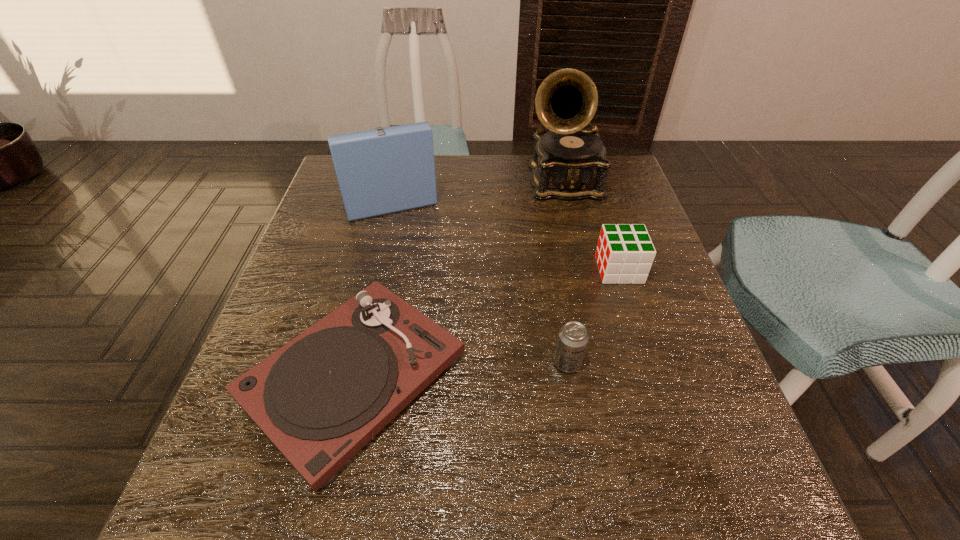
Where is `free space at the far edge of the desktop`? free space at the far edge of the desktop is located at coordinates (507, 172).

Locate an element on the screen. vacant space at the near edge of the desktop is located at coordinates (610, 526).

The width and height of the screenshot is (960, 540). What are the coordinates of `vacant position at the left edge of the desktop` in the screenshot? It's located at (347, 271).

You are a GUI agent. You are given a task and a screenshot of the screen. Output one action in this format:
    pyautogui.click(x=<x>, y=<y>)
    Task: Click on the blank space at the right edge
    
    Given the screenshot: What is the action you would take?
    pyautogui.click(x=643, y=442)

This screenshot has width=960, height=540. Find the location of `free location at the far left corner`. free location at the far left corner is located at coordinates tap(340, 193).

Where is `free point at the far right corner`? This screenshot has width=960, height=540. free point at the far right corner is located at coordinates (624, 202).

This screenshot has width=960, height=540. What are the coordinates of `free space at the near right corner of the desktop` in the screenshot? It's located at (756, 485).

The width and height of the screenshot is (960, 540). Find the location of `free spot between the rightmost phonograph_record and the shortest phonograph_record`. free spot between the rightmost phonograph_record and the shortest phonograph_record is located at coordinates (459, 279).

You are a GUI agent. You are given a task and a screenshot of the screen. Output one action in this format:
    pyautogui.click(x=<x>, y=<y>)
    Task: Click on the vacant space in between the third nearest object and the beer can
    
    Given the screenshot: What is the action you would take?
    pyautogui.click(x=593, y=316)

At what (x,y) coordinates should I click in order to perform the action: click on vacant area that lies between the beer can and the shortest object. Please return your answer as a coordinate pair (x, y). Image resolution: width=960 pixels, height=540 pixels. Looking at the image, I should click on (461, 370).